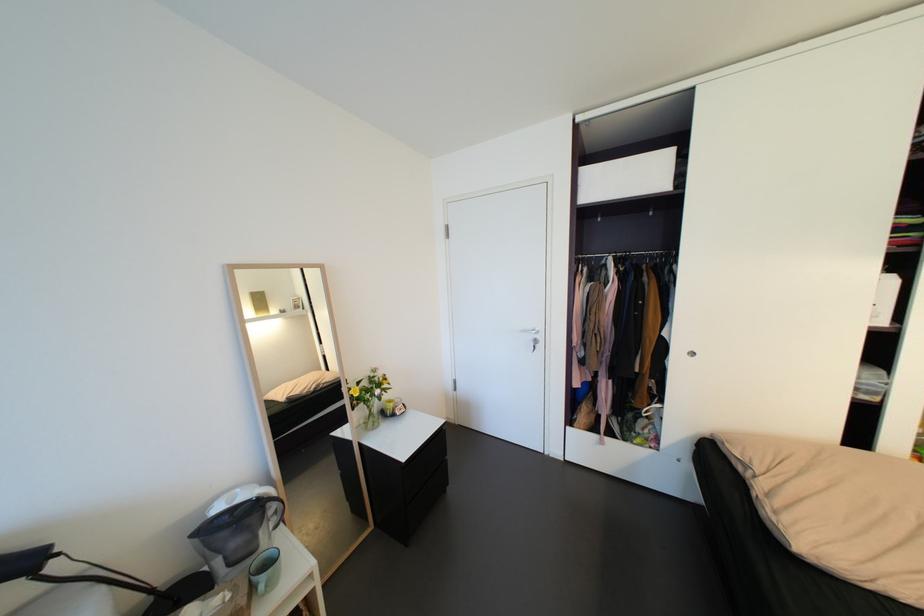
Which object does [237,530] point to?

This point indicates the black water pitcher.